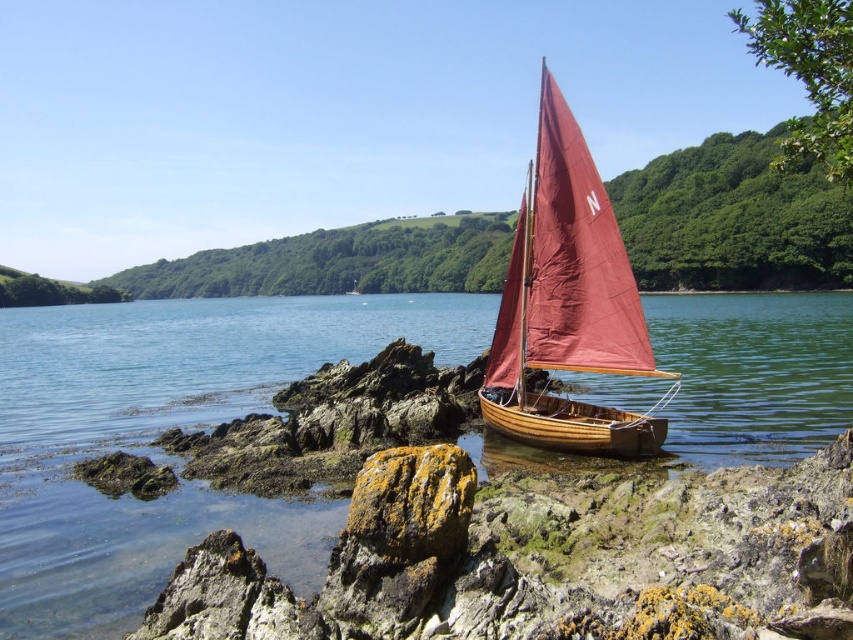
You are a sailor trying to dock your boat. You see the wooden sailboat at center and the clear water at boat right. Which one is wider?

The clear water at boat right is wider than the wooden sailboat at center.

You are a sailor standing on the wooden sailboat at center. You want to check the water level near your boat. Which direction should you look to see the clear water at boat right?

You should look to the right side of the wooden sailboat at center because the clear water at boat right is located above it, meaning it is positioned higher and to the right direction from the boat.